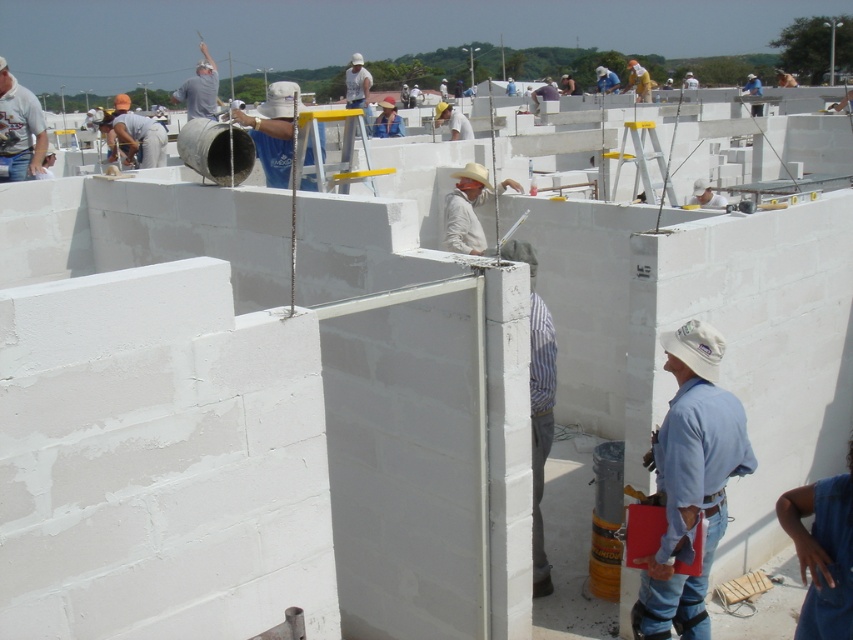
Question: Which object appears farthest from the camera in this image?

Choices:
 (A) gray cotton shirt at upper center
 (B) white matte concrete worker at center

Answer: (A)

Question: Is the position of white matte bucket at center more distant than that of white matte hard hat at upper center?

Choices:
 (A) yes
 (B) no

Answer: (B)

Question: Is white striped shirt at center below white matte construction worker at center?

Choices:
 (A) yes
 (B) no

Answer: (A)

Question: Which point is farther to the camera?

Choices:
 (A) blue denim jeans at lower right
 (B) gray cotton shirt at upper center
 (C) white matte bucket at center
 (D) white matte hard hat at upper center

Answer: (D)

Question: Among these points, which one is farthest from the camera?

Choices:
 (A) coord(554,88)
 (B) coord(535,394)
 (C) coord(265,170)
 (D) coord(708,497)

Answer: (A)

Question: Can you confirm if white cotton shirt at upper left is bigger than matte white concrete block at upper left?

Choices:
 (A) yes
 (B) no

Answer: (B)